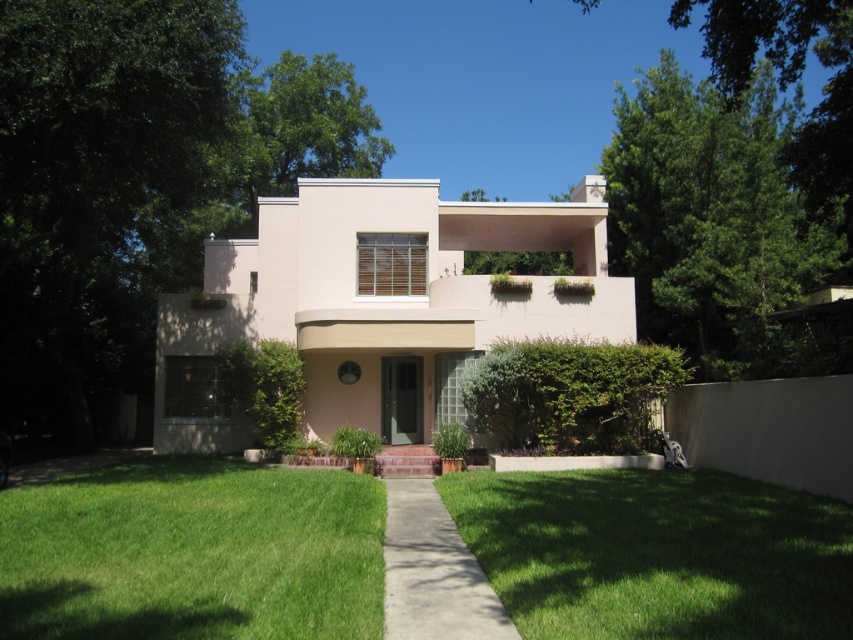
Question: Is green grass at lower center smaller than green leafy tree at upper right?

Choices:
 (A) yes
 (B) no

Answer: (A)

Question: Is beige concrete villa at center positioned behind green grass at lower left?

Choices:
 (A) yes
 (B) no

Answer: (A)

Question: Considering the real-world distances, which object is farthest from the green grass at lower center?

Choices:
 (A) green leafy tree at upper right
 (B) green leafy tree at left

Answer: (B)

Question: Which point is closer to the camera?

Choices:
 (A) (200, 538)
 (B) (711, 477)
 (C) (723, 150)
 (D) (44, 280)

Answer: (A)

Question: Can you confirm if beige concrete villa at center is thinner than green grass at lower center?

Choices:
 (A) no
 (B) yes

Answer: (A)

Question: Estimate the real-world distances between objects in this image. Which object is farther from the concrete at center?

Choices:
 (A) green grass at lower left
 (B) green grass at lower center
 (C) green leafy tree at left
 (D) green leafy tree at upper right

Answer: (D)